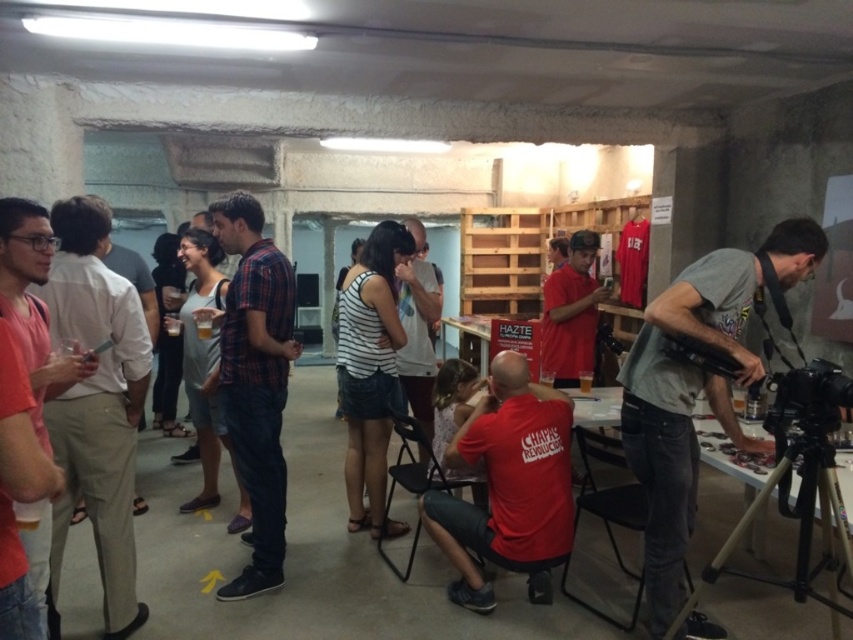
I want to click on matte black shirt at left, so click(97, 403).

The height and width of the screenshot is (640, 853). Describe the element at coordinates (97, 403) in the screenshot. I see `matte black shirt at left` at that location.

At what (x,y) coordinates should I click in order to perform the action: click on matte black shirt at left. Please return your answer as a coordinate pair (x, y). Image resolution: width=853 pixels, height=640 pixels. Looking at the image, I should click on coord(97,403).

In the scene shown: Which is above, matte black shirt at left or red matte shirt at center?

matte black shirt at left is higher up.

Where is `matte black shirt at left`? matte black shirt at left is located at coordinates (97, 403).

Between point (50, 509) and point (566, 264), which one is positioned behind?

The point (566, 264) is more distant.

The height and width of the screenshot is (640, 853). What do you see at coordinates (33, 304) in the screenshot?
I see `matte orange t-shirt at left` at bounding box center [33, 304].

Is point (19, 266) behind point (598, 298)?

No, (19, 266) is in front of (598, 298).

I want to click on matte orange t-shirt at left, so click(x=33, y=304).